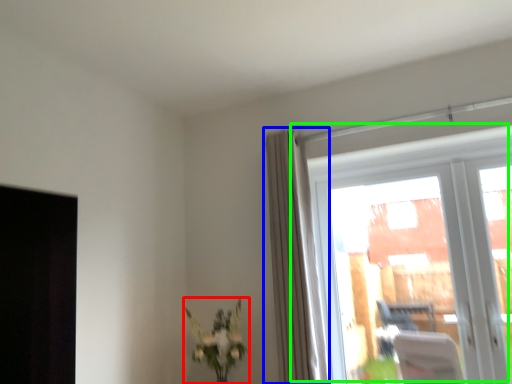
Question: Based on their relative distances, which object is nearer to houseplant (highlighted by a red box)? Choose from curtain (highlighted by a blue box) and window (highlighted by a green box).

Choices:
 (A) curtain
 (B) window

Answer: (A)